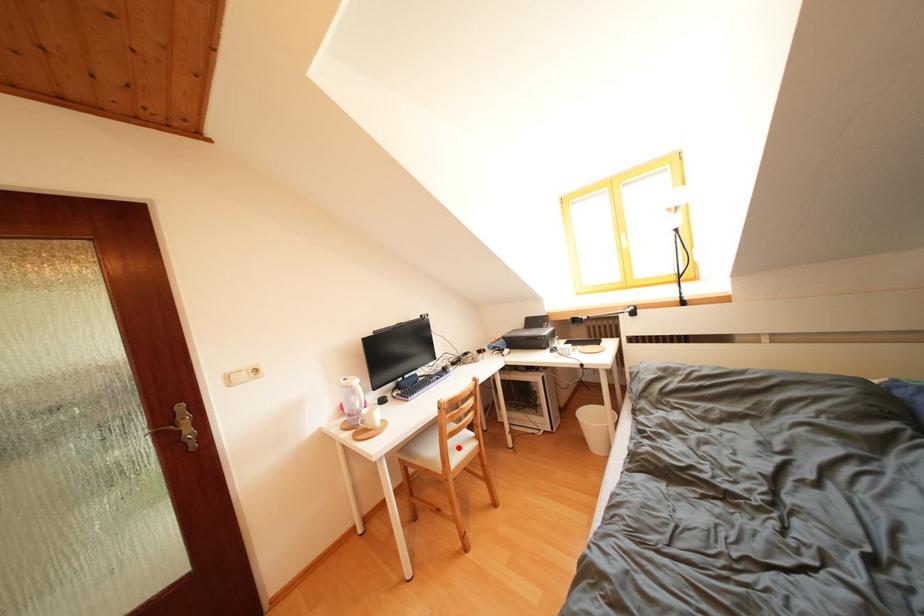
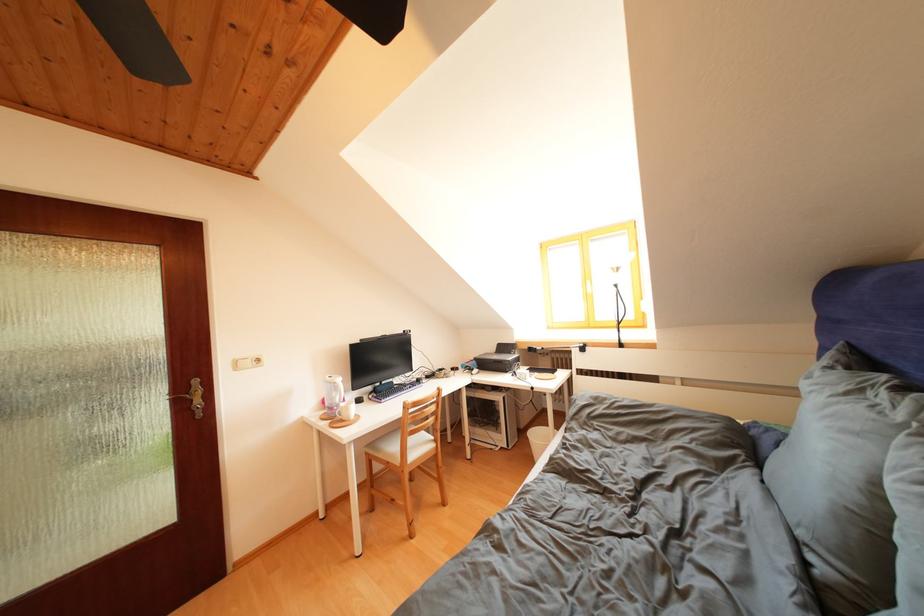
Locate, in the second image, the point that corresponds to the highlighted location in the first image.

(419, 446)